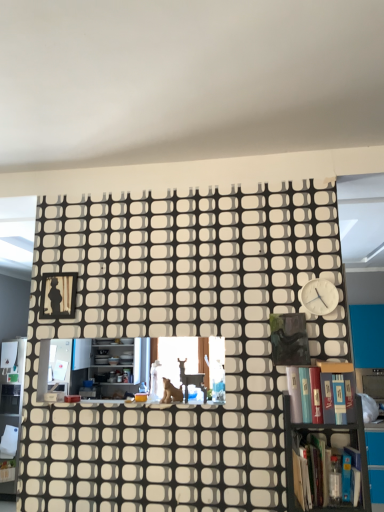
Identify the location of metallic gray bookcase at lower right, arranged as the 2th bookcase when viewed from the back. This screenshot has width=384, height=512. (324, 452).

This screenshot has width=384, height=512. What are the coordinates of `hardcover book at right, marked as the first book in a top-to-bottom arrangement` in the screenshot? It's located at (332, 392).

In order to face white matte clock at upper right, should I rotate leftwards or rightwards?

Turn right approximately 16.968 degrees to face it.

What is the approximate height of white matte clock at upper right?

white matte clock at upper right is 7.90 inches in height.

The image size is (384, 512). Find the location of `wooden bookcase at center, which ranks as the first bookcase in back-to-front order`. wooden bookcase at center, which ranks as the first bookcase in back-to-front order is located at coordinates (182, 334).

The height and width of the screenshot is (512, 384). Identify the location of metallic gray bookcase at lower right, arranged as the 2th bookcase when viewed from the back. (324, 452).

Are metallic gray bookcase at lower right, marked as the first bookcase in a front-to-back arrangement, and black matte picture frame at upper left beside each other?

No, metallic gray bookcase at lower right, marked as the first bookcase in a front-to-back arrangement, is not next to black matte picture frame at upper left.

Considering the relative positions of metallic gray bookcase at lower right, marked as the first bookcase in a front-to-back arrangement, and black matte picture frame at upper left in the image provided, is metallic gray bookcase at lower right, marked as the first bookcase in a front-to-back arrangement, behind black matte picture frame at upper left?

No, metallic gray bookcase at lower right, marked as the first bookcase in a front-to-back arrangement, is in front of black matte picture frame at upper left.

Is metallic gray bookcase at lower right, arranged as the 2th bookcase when viewed from the back, positioned beyond the bounds of black matte picture frame at upper left?

Yes, metallic gray bookcase at lower right, arranged as the 2th bookcase when viewed from the back, is outside of black matte picture frame at upper left.

Considering the relative sizes of metallic gray bookcase at lower right, arranged as the 2th bookcase when viewed from the back, and black matte picture frame at upper left in the image provided, is metallic gray bookcase at lower right, arranged as the 2th bookcase when viewed from the back, thinner than black matte picture frame at upper left?

No, metallic gray bookcase at lower right, arranged as the 2th bookcase when viewed from the back, is not thinner than black matte picture frame at upper left.

From a real-world perspective, is hardcover book at lower right, which appears as the second book when viewed from the top, physically below brown fur cat at center?

Indeed, from a real-world perspective, hardcover book at lower right, which appears as the second book when viewed from the top, is positioned beneath brown fur cat at center.

Measure the distance from hardcover book at lower right, which appears as the second book when viewed from the top, to brown fur cat at center.

The distance of hardcover book at lower right, which appears as the second book when viewed from the top, from brown fur cat at center is 30.28 inches.

Is hardcover book at lower right, which appears as the second book when viewed from the top, not within brown fur cat at center?

Yes.

Can you confirm if hardcover book at right, marked as the first book in a top-to-bottom arrangement, is wider than hardcover book at lower right, which is the 1th book from bottom to top?

No.

From a real-world perspective, which object stands above the other?

hardcover book at right, which is counted as the 2th book, starting from the bottom, is physically above.

Is hardcover book at right, which is counted as the 2th book, starting from the bottom, closer to the viewer compared to hardcover book at lower right, which appears as the second book when viewed from the top?

No, it is behind hardcover book at lower right, which appears as the second book when viewed from the top.

Between hardcover book at right, marked as the first book in a top-to-bottom arrangement, and hardcover book at lower right, which appears as the second book when viewed from the top, which one has less height?

Standing shorter between the two is hardcover book at right, marked as the first book in a top-to-bottom arrangement.

From a real-world perspective, is hardcover book at right, marked as the first book in a top-to-bottom arrangement, physically located above or below brown fur cat at center?

From a real-world perspective, hardcover book at right, marked as the first book in a top-to-bottom arrangement, is physically above brown fur cat at center.

In terms of width, does hardcover book at right, marked as the first book in a top-to-bottom arrangement, look wider or thinner when compared to brown fur cat at center?

Clearly, hardcover book at right, marked as the first book in a top-to-bottom arrangement, has more width compared to brown fur cat at center.

Is hardcover book at right, marked as the first book in a top-to-bottom arrangement, looking in the opposite direction of brown fur cat at center?

hardcover book at right, marked as the first book in a top-to-bottom arrangement, does not have its back to brown fur cat at center.

From a real-world perspective, is black matte picture frame at upper left below white matte clock at upper right?

No.

Is point (50, 304) in front of point (318, 309)?

That is False.

From the image's perspective, relative to white matte clock at upper right, is black matte picture frame at upper left above or below?

black matte picture frame at upper left is situated lower than white matte clock at upper right in the image.

Which is behind, hardcover book at lower right, which appears as the second book when viewed from the top, or metallic gray bookcase at lower right, arranged as the 2th bookcase when viewed from the back?

hardcover book at lower right, which appears as the second book when viewed from the top.

Does hardcover book at lower right, which is the 1th book from bottom to top, have a greater height compared to metallic gray bookcase at lower right, arranged as the 2th bookcase when viewed from the back?

Incorrect, the height of hardcover book at lower right, which is the 1th book from bottom to top, is not larger of that of metallic gray bookcase at lower right, arranged as the 2th bookcase when viewed from the back.

Starting from the metallic gray bookcase at lower right, arranged as the 2th bookcase when viewed from the back, which book is the 1st one behind? Please provide its 2D coordinates.

[(325, 463)]

Consider the image. Does hardcover book at lower right, which appears as the second book when viewed from the top, contain metallic gray bookcase at lower right, arranged as the 2th bookcase when viewed from the back?

Yes, hardcover book at lower right, which appears as the second book when viewed from the top, is surrounding metallic gray bookcase at lower right, arranged as the 2th bookcase when viewed from the back.

Can you confirm if white matte clock at upper right is positioned to the left of metallic gray bookcase at lower right, marked as the first bookcase in a front-to-back arrangement?

No.

From the image's perspective, between white matte clock at upper right and metallic gray bookcase at lower right, marked as the first bookcase in a front-to-back arrangement, which one is located above?

white matte clock at upper right appears higher in the image.

Is metallic gray bookcase at lower right, arranged as the 2th bookcase when viewed from the back, surrounded by white matte clock at upper right?

No, metallic gray bookcase at lower right, arranged as the 2th bookcase when viewed from the back, is not inside white matte clock at upper right.

From a real-world perspective, is white matte clock at upper right below metallic gray bookcase at lower right, arranged as the 2th bookcase when viewed from the back?

No, from a real-world perspective, white matte clock at upper right is not below metallic gray bookcase at lower right, arranged as the 2th bookcase when viewed from the back.

Where is `picture frame above the metallic gray bookcase at lower right, marked as the first bookcase in a front-to-back arrangement (from the image's perspective)`? The image size is (384, 512). picture frame above the metallic gray bookcase at lower right, marked as the first bookcase in a front-to-back arrangement (from the image's perspective) is located at coordinates (58, 295).

I want to click on animal above the hardcover book at lower right, which is the 1th book from bottom to top (from a real-world perspective), so click(x=171, y=392).

From the image, which object appears to be nearer to metallic gray bookcase at lower right, arranged as the 2th bookcase when viewed from the back, white matte clock at upper right or brown fur cat at center?

white matte clock at upper right is positioned closer to the anchor metallic gray bookcase at lower right, arranged as the 2th bookcase when viewed from the back.

Which object lies further to the anchor point metallic gray bookcase at lower right, marked as the first bookcase in a front-to-back arrangement, black matte picture frame at upper left or wooden bookcase at center, which is counted as the 2th bookcase, starting from the front?

Based on the image, black matte picture frame at upper left appears to be further to metallic gray bookcase at lower right, marked as the first bookcase in a front-to-back arrangement.

Based on their spatial positions, is white matte clock at upper right or hardcover book at lower right, which appears as the second book when viewed from the top, further from metallic gray bookcase at lower right, arranged as the 2th bookcase when viewed from the back?

Based on the image, white matte clock at upper right appears to be further to metallic gray bookcase at lower right, arranged as the 2th bookcase when viewed from the back.

Based on the photo, which object lies nearer to the anchor point hardcover book at lower right, which is the 1th book from bottom to top, white matte clock at upper right or wooden bookcase at center, which is counted as the 2th bookcase, starting from the front?

white matte clock at upper right lies closer to hardcover book at lower right, which is the 1th book from bottom to top, than the other object.

Based on their spatial positions, is white matte clock at upper right or hardcover book at right, marked as the first book in a top-to-bottom arrangement, further from black matte picture frame at upper left?

hardcover book at right, marked as the first book in a top-to-bottom arrangement, is positioned further to the anchor black matte picture frame at upper left.

Based on their spatial positions, is metallic gray bookcase at lower right, arranged as the 2th bookcase when viewed from the back, or hardcover book at lower right, which is the 1th book from bottom to top, further from wooden bookcase at center, which is counted as the 2th bookcase, starting from the front?

hardcover book at lower right, which is the 1th book from bottom to top, is positioned further to the anchor wooden bookcase at center, which is counted as the 2th bookcase, starting from the front.

From the image, which object appears to be nearer to hardcover book at right, marked as the first book in a top-to-bottom arrangement, metallic gray bookcase at lower right, marked as the first bookcase in a front-to-back arrangement, or wooden bookcase at center, which is counted as the 2th bookcase, starting from the front?

metallic gray bookcase at lower right, marked as the first bookcase in a front-to-back arrangement, is positioned closer to the anchor hardcover book at right, marked as the first book in a top-to-bottom arrangement.

Looking at the image, which one is located closer to black matte picture frame at upper left, hardcover book at right, marked as the first book in a top-to-bottom arrangement, or wooden bookcase at center, which is counted as the 2th bookcase, starting from the front?

Among the two, wooden bookcase at center, which is counted as the 2th bookcase, starting from the front, is located nearer to black matte picture frame at upper left.

Where is `book between wooden bookcase at center, which is counted as the 2th bookcase, starting from the front, and hardcover book at lower right, which appears as the second book when viewed from the top`? The width and height of the screenshot is (384, 512). book between wooden bookcase at center, which is counted as the 2th bookcase, starting from the front, and hardcover book at lower right, which appears as the second book when viewed from the top is located at coordinates (332, 392).

At what (x,y) coordinates should I click in order to perform the action: click on bookcase between black matte picture frame at upper left and metallic gray bookcase at lower right, arranged as the 2th bookcase when viewed from the back, from left to right. Please return your answer as a coordinate pair (x, y). Looking at the image, I should click on (182, 334).

Image resolution: width=384 pixels, height=512 pixels. I want to click on book between white matte clock at upper right and metallic gray bookcase at lower right, arranged as the 2th bookcase when viewed from the back, vertically, so click(x=332, y=392).

Find the location of a particular element. bookcase between brown fur cat at center and metallic gray bookcase at lower right, arranged as the 2th bookcase when viewed from the back, from left to right is located at coordinates (182, 334).